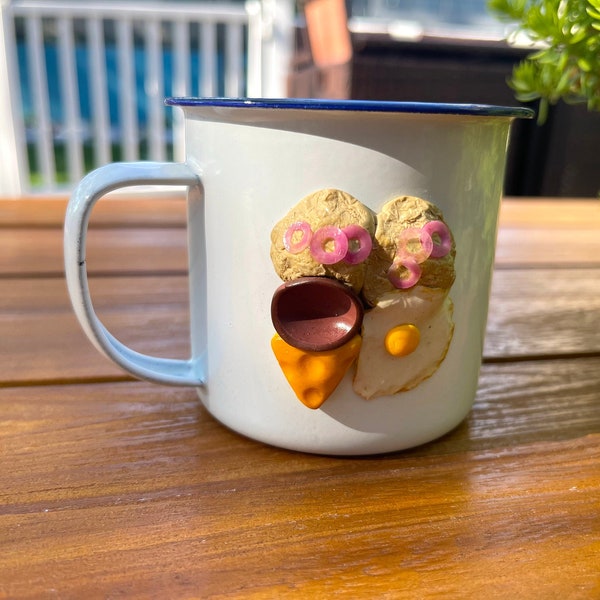
Locate an element on the screen. The height and width of the screenshot is (600, 600). wood table is located at coordinates (295, 528).